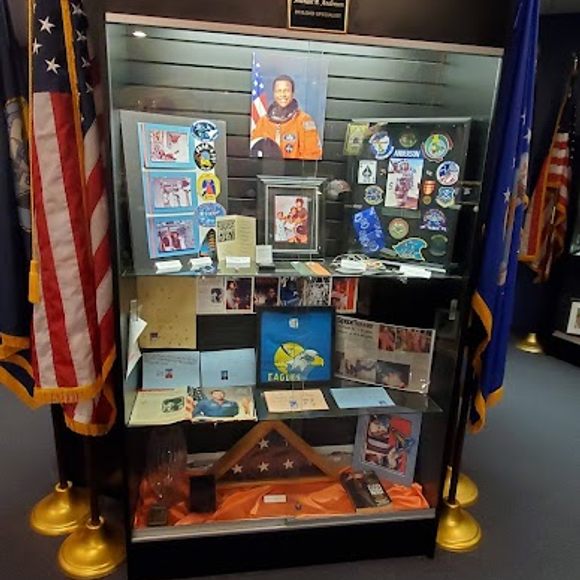
Locate an element on the screen. The height and width of the screenshot is (580, 580). triangle shadow box is located at coordinates (287, 449).